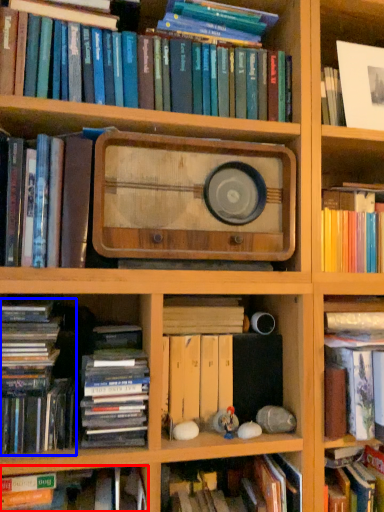
Question: Which of the following is the farthest to the observer, book (highlighted by a red box) or book (highlighted by a blue box)?

Choices:
 (A) book
 (B) book

Answer: (B)